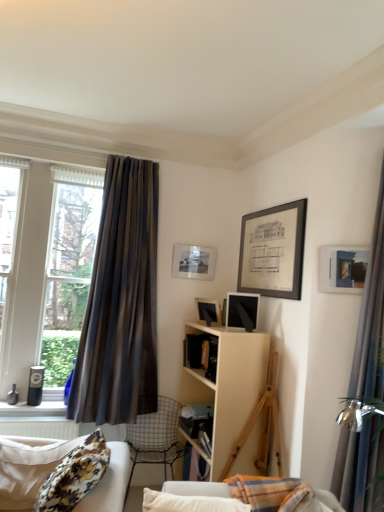
Question: Looking at the image, does matte black speaker at left seem bigger or smaller compared to matte glass picture frame at upper center, placed as the first picture frame when sorted from back to front?

Choices:
 (A) big
 (B) small

Answer: (B)

Question: In terms of width, does matte black speaker at left look wider or thinner when compared to matte glass picture frame at upper center, placed as the third picture frame when sorted from right to left?

Choices:
 (A) wide
 (B) thin

Answer: (A)

Question: Which object is the closest to the matte black speaker at left?

Choices:
 (A) brown striped curtain at left, which is the second curtain in front-to-back order
 (B) matte black picture frame at center, positioned as the second picture frame in front-to-back order
 (C) beige wood shelf at center
 (D) floral fabric studio couch at lower left
 (E) matte glass picture frame at upper center, positioned as the 3th picture frame in front-to-back order

Answer: (A)

Question: Estimate the real-world distances between objects in this image. Which object is closer to the brown striped curtain at left, marked as the 1th curtain in a back-to-front arrangement?

Choices:
 (A) floral fabric studio couch at lower left
 (B) beige wood shelf at center
 (C) matte glass picture frame at upper center, the 1th picture frame from the left
 (D) silky blue curtain at right, the second curtain from the left
 (E) matte blue picture frame at upper right, acting as the first picture frame starting from the right

Answer: (C)